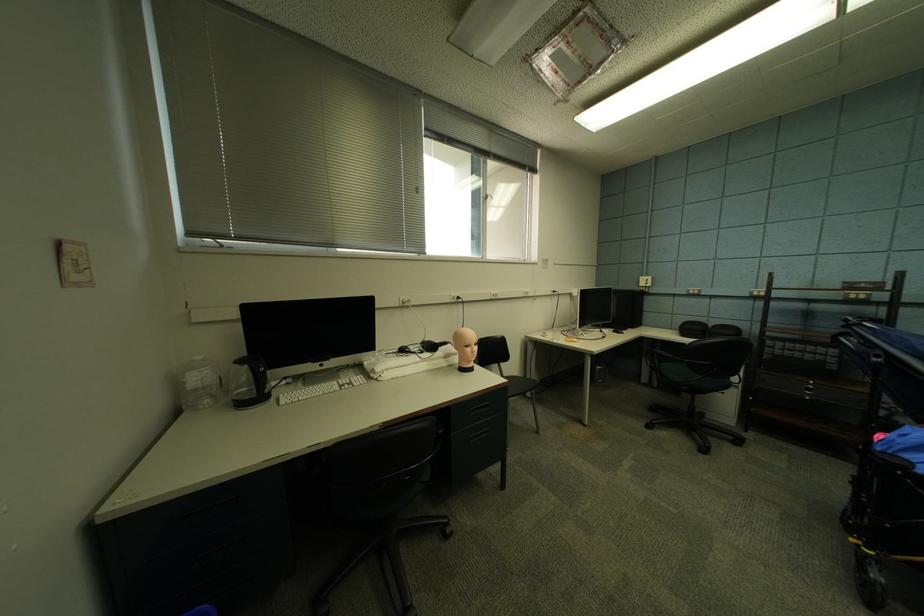
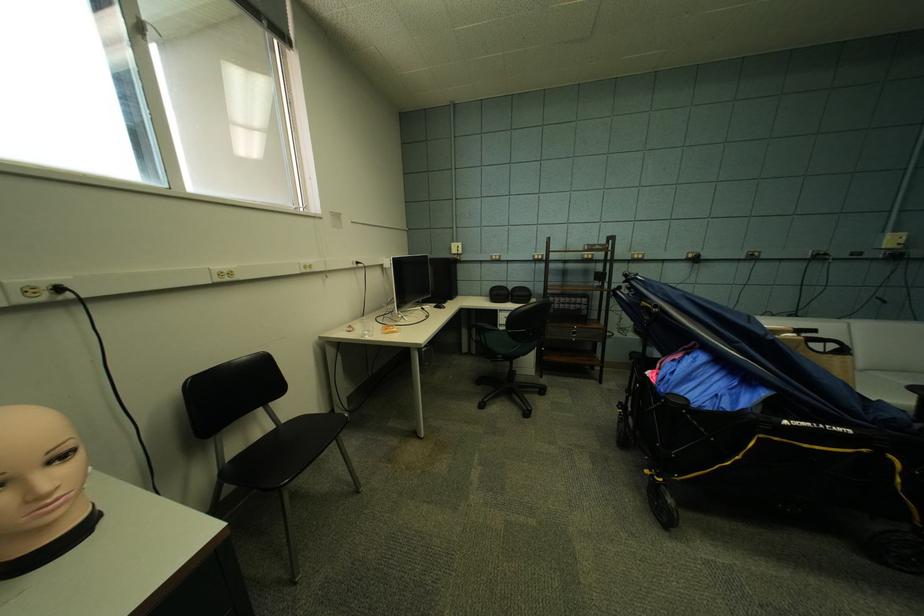
The point at (484, 346) is marked in the first image. Where is the corresponding point in the second image?

(70, 459)